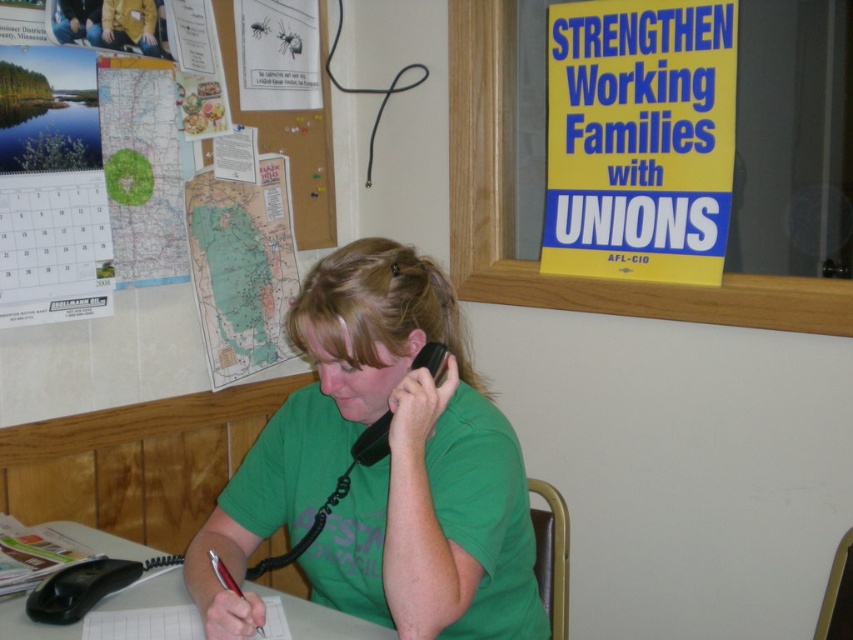
Is point (328, 396) more distant than point (300, 636)?

Yes, point (328, 396) is farther from viewer.

Is green matte shirt at center to the right of white paper at center from the viewer's perspective?

Indeed, green matte shirt at center is positioned on the right side of white paper at center.

The height and width of the screenshot is (640, 853). Identify the location of green matte shirt at center. (381, 468).

Does green matte shirt at center have a lesser width compared to black rubber phone at center?

In fact, green matte shirt at center might be wider than black rubber phone at center.

Is green matte shirt at center closer to the viewer compared to black rubber phone at center?

That is True.

Between point (503, 554) and point (387, 452), which one is positioned behind?

Positioned behind is point (387, 452).

The width and height of the screenshot is (853, 640). Identify the location of green matte shirt at center. (381, 468).

Can you confirm if green map at upper left is smaller than black rubber phone at center?

Actually, green map at upper left might be larger than black rubber phone at center.

The width and height of the screenshot is (853, 640). I want to click on green map at upper left, so click(x=242, y=268).